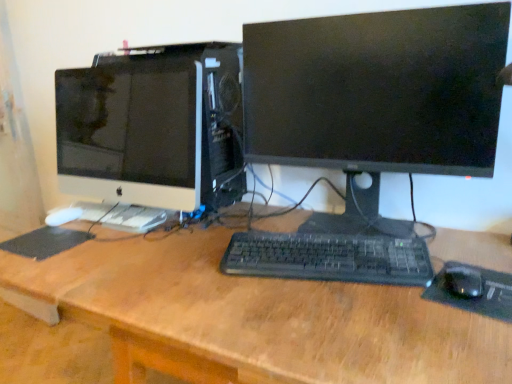
The height and width of the screenshot is (384, 512). I want to click on vacant space in front of white matte keyboard at left, so click(x=101, y=253).